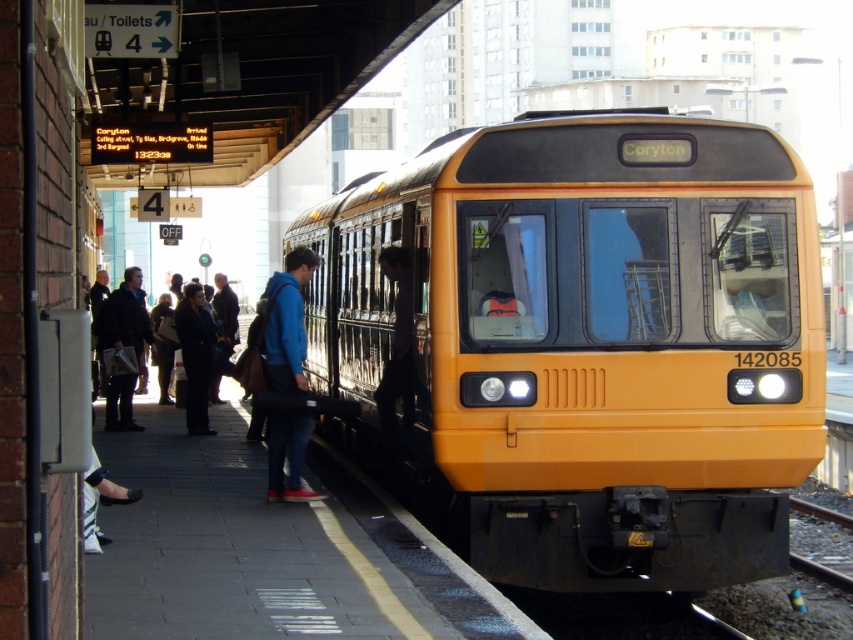
Question: Does blue fabric backpack at center have a larger size compared to dark brown leather jacket at left?

Choices:
 (A) yes
 (B) no

Answer: (B)

Question: Does blue fabric backpack at center have a lesser width compared to dark brown leather jacket at left?

Choices:
 (A) no
 (B) yes

Answer: (B)

Question: Which point is farther to the camera?

Choices:
 (A) (627, 412)
 (B) (296, 432)
 (C) (137, 332)

Answer: (C)

Question: Considering the relative positions of yellow matte train at center and blue fabric backpack at center in the image provided, where is yellow matte train at center located with respect to blue fabric backpack at center?

Choices:
 (A) above
 (B) below

Answer: (A)

Question: Which of the following is the closest to the observer?

Choices:
 (A) blue fabric backpack at center
 (B) yellow matte train at center

Answer: (B)

Question: Estimate the real-world distances between objects in this image. Which object is farther from the yellow matte train at center?

Choices:
 (A) blue fabric backpack at center
 (B) dark brown leather jacket at left

Answer: (B)